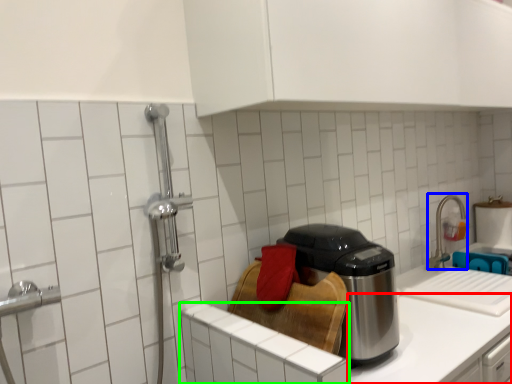
Question: Considering the real-world distances, which object is closest to counter top (highlighted by a red box)? faucet (highlighted by a blue box) or cabinetry (highlighted by a green box).

Choices:
 (A) faucet
 (B) cabinetry

Answer: (B)